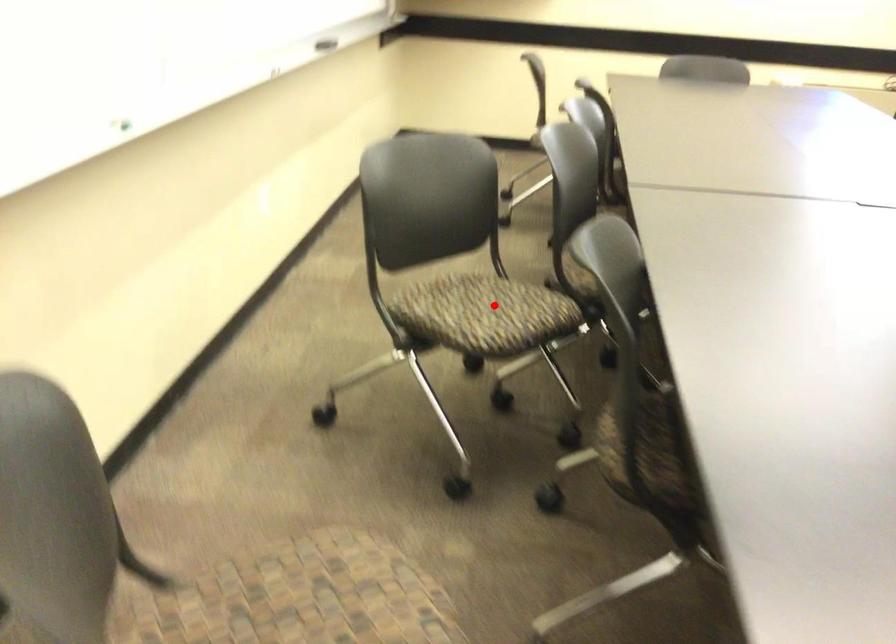
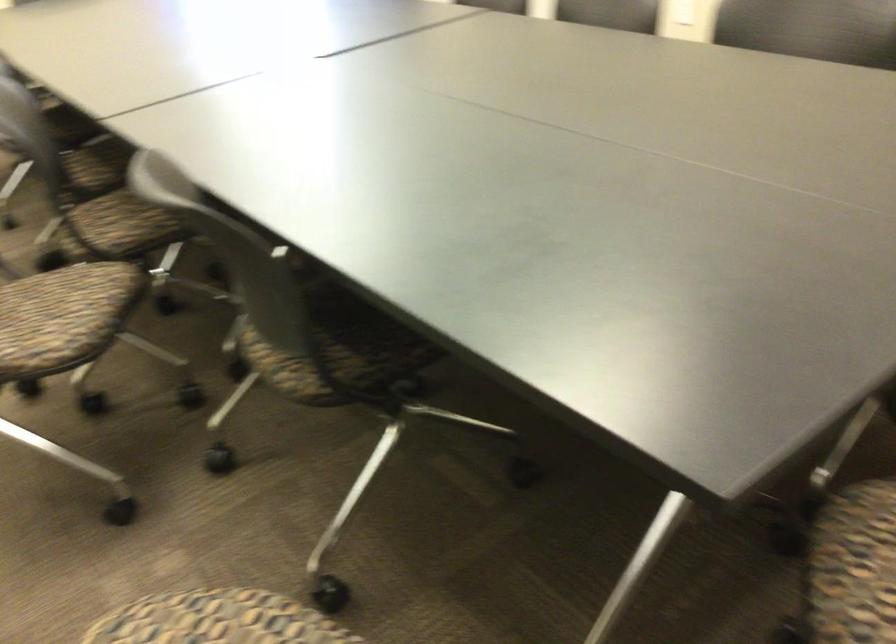
Locate, in the second image, the point that corresponds to the highlighted location in the first image.

(53, 307)